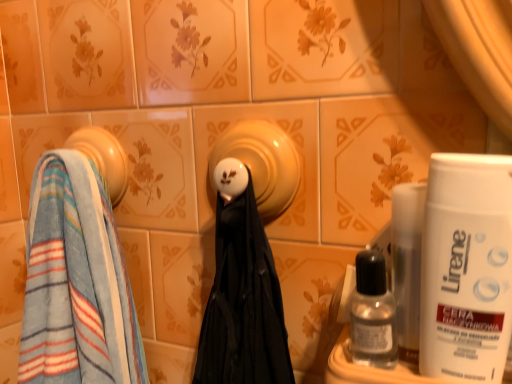
Question: Considering the positions of matte yellow ceramic at center and white matte shaving cream at right in the image, is matte yellow ceramic at center wider or thinner than white matte shaving cream at right?

Choices:
 (A) thin
 (B) wide

Answer: (B)

Question: Considering the positions of point [229, 122] and point [426, 372], is point [229, 122] closer or farther from the camera than point [426, 372]?

Choices:
 (A) closer
 (B) farther

Answer: (B)

Question: Considering the real-world distances, which object is farthest from the transparent plastic bottle at lower right?

Choices:
 (A) matte yellow ceramic at center
 (B) blue striped towel at left, the second towel viewed from the top
 (C) white matte shaving cream at right
 (D) blue striped towel at left, positioned as the 1th towel in top-to-bottom order

Answer: (D)

Question: Which is farther from the blue striped towel at left, placed as the first towel when sorted from bottom to top?

Choices:
 (A) matte yellow ceramic at center
 (B) white matte shaving cream at right
 (C) transparent plastic bottle at lower right
 (D) blue striped towel at left, positioned as the 1th towel in top-to-bottom order

Answer: (B)